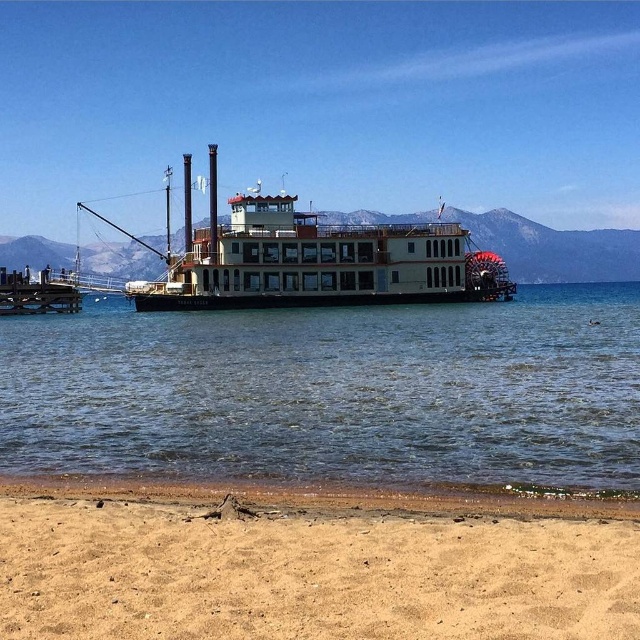
Question: Which point is closer to the camera?

Choices:
 (A) tan sandy beach at lower center
 (B) wooden dock at center

Answer: (A)

Question: Which object appears farthest from the camera in this image?

Choices:
 (A) clear blue water at center
 (B) tan sandy beach at lower center
 (C) white wooden paddlewheel boat at center

Answer: (C)

Question: Can you confirm if clear blue water at center is wider than wooden dock at center?

Choices:
 (A) yes
 (B) no

Answer: (B)

Question: Does clear blue water at center come in front of white wooden paddlewheel boat at center?

Choices:
 (A) yes
 (B) no

Answer: (A)

Question: Considering the relative positions of white wooden paddlewheel boat at center and wooden dock at center in the image provided, where is white wooden paddlewheel boat at center located with respect to wooden dock at center?

Choices:
 (A) below
 (B) above

Answer: (B)

Question: Which object appears closest to the camera in this image?

Choices:
 (A) tan sandy beach at lower center
 (B) white wooden paddlewheel boat at center
 (C) clear blue water at center
 (D) wooden dock at center

Answer: (A)